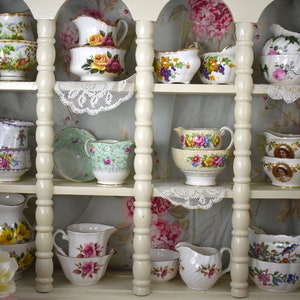
The image size is (300, 300). In order to click on doylies in this screenshot , I will do `click(205, 196)`, `click(94, 88)`.